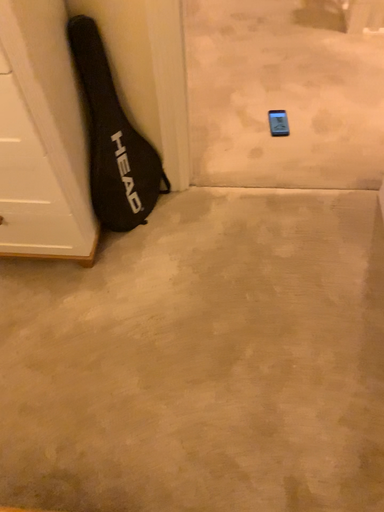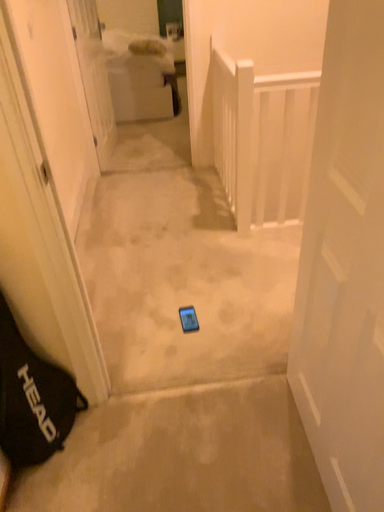
Question: How did the camera likely rotate when shooting the video?

Choices:
 (A) rotated upward
 (B) rotated downward

Answer: (A)